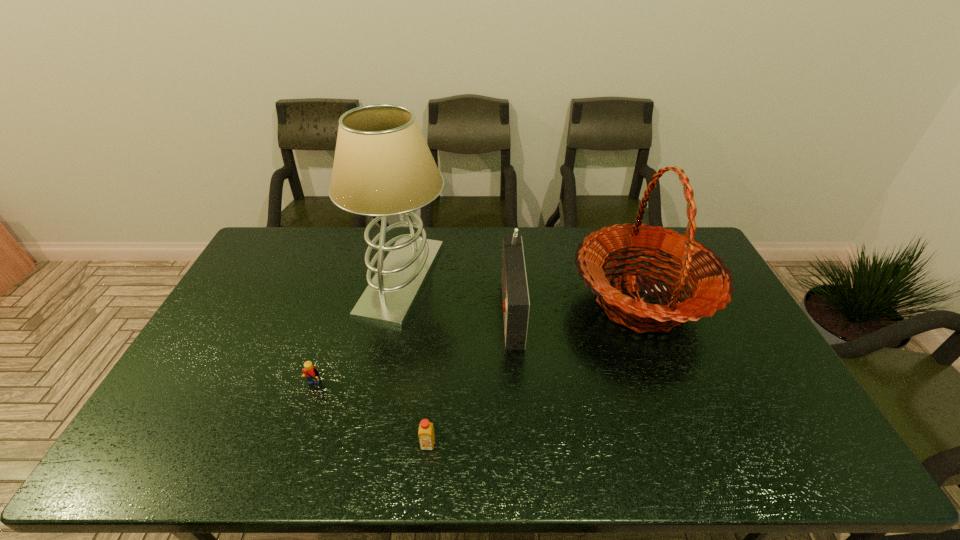
I want to click on the tallest object, so (383, 167).

The image size is (960, 540). Find the location of `the second tallest object`. the second tallest object is located at coordinates (712, 282).

I want to click on the rightmost object, so coord(712,282).

Where is `the third tallest object`? the third tallest object is located at coordinates (516, 304).

In order to click on radio receiver in this screenshot , I will do `click(516, 304)`.

Find the location of a particular element. the second nearest object is located at coordinates (310, 372).

At what (x,y) coordinates should I click in order to perform the action: click on Lego. Please return your answer as a coordinate pair (x, y). The height and width of the screenshot is (540, 960). Looking at the image, I should click on (310, 372).

The height and width of the screenshot is (540, 960). Find the location of `the shortest object`. the shortest object is located at coordinates 426,435.

Where is `orange juice`? This screenshot has height=540, width=960. orange juice is located at coordinates (426, 435).

The height and width of the screenshot is (540, 960). I want to click on vacant space located 0.200m on the front of the tallest object, so click(380, 382).